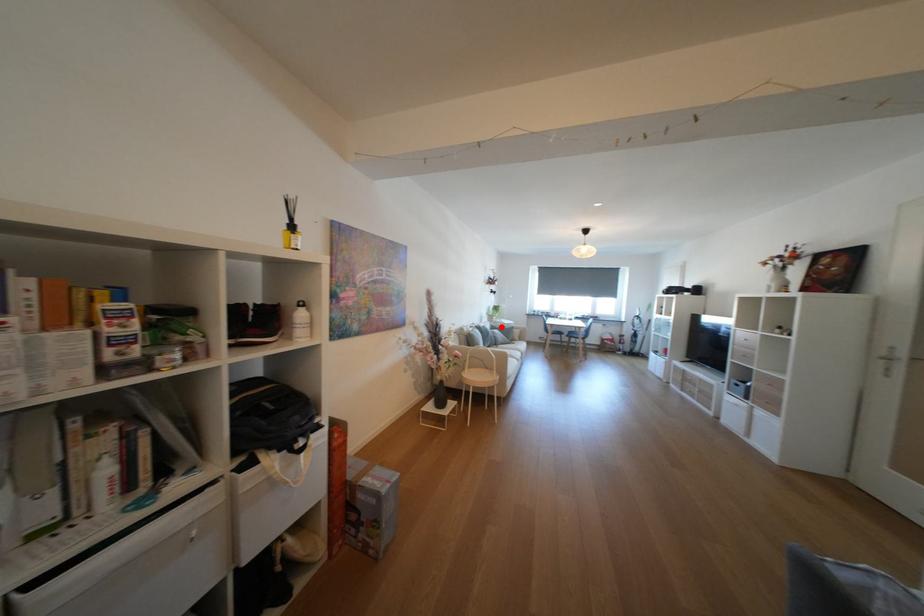
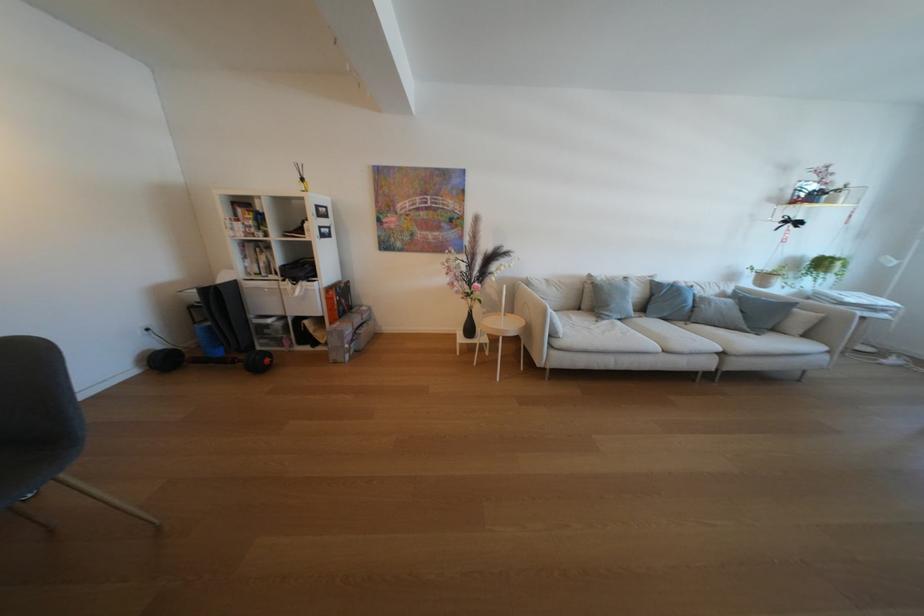
Find the pixel in the second image that matches the highlighted location in the first image.

(739, 292)